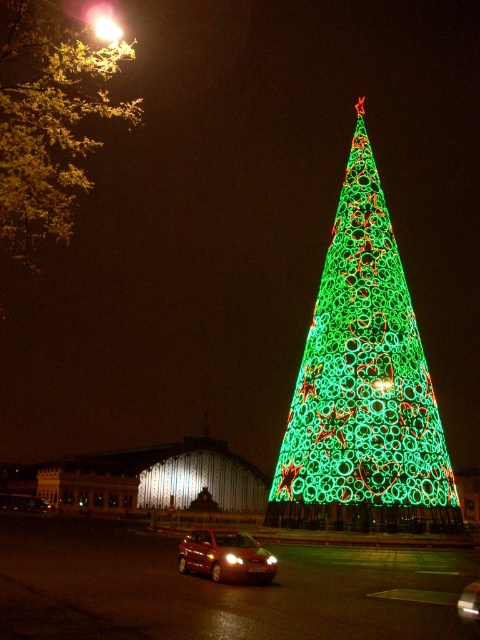
You are standing in the festive nighttime scene and want to move from the point closer to you to the point further away. Which path would you take between the two points, point (35,237) and point (470,605)?

You should move from point (35,237) to point (470,605) because point (35,237) is closer to you and point (470,605) is further away.

You are a pedestrian standing on the road and want to reach the green illuminated christmas tree at center. Which direction should you move relative to the matte red car at lower center?

The green illuminated christmas tree at center is closer to you than the matte red car at lower center, so you should move towards the direction of the green illuminated christmas tree at center, away from the matte red car at lower center.